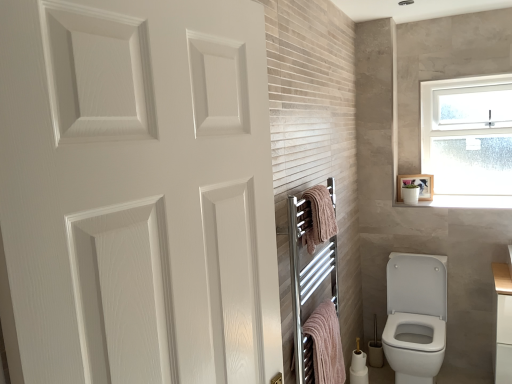
Question: Is white glossy toilet paper at lower right, the 1th toilet paper from the top, placed right next to white glossy toilet at lower right?

Choices:
 (A) yes
 (B) no

Answer: (B)

Question: From a real-world perspective, is white glossy toilet paper at lower right, the 1th toilet paper from the top, over white glossy toilet at lower right?

Choices:
 (A) no
 (B) yes

Answer: (A)

Question: Can you confirm if white glossy toilet paper at lower right, positioned as the second toilet paper in bottom-to-top order, is smaller than white glossy toilet at lower right?

Choices:
 (A) no
 (B) yes

Answer: (B)

Question: Can white glossy toilet at lower right be found inside white glossy toilet paper at lower right, the 1th toilet paper from the top?

Choices:
 (A) yes
 (B) no

Answer: (B)

Question: Does white glossy toilet paper at lower right, the 1th toilet paper from the top, have a lesser height compared to white glossy toilet at lower right?

Choices:
 (A) no
 (B) yes

Answer: (B)

Question: Is white glossy toilet paper at lower right, the 1th toilet paper from the top, at the right side of white glossy toilet at lower right?

Choices:
 (A) no
 (B) yes

Answer: (A)

Question: Considering the relative positions of white glossy toilet at lower right and white glossy toilet paper at lower right, positioned as the second toilet paper in bottom-to-top order, in the image provided, is white glossy toilet at lower right behind white glossy toilet paper at lower right, positioned as the second toilet paper in bottom-to-top order,?

Choices:
 (A) yes
 (B) no

Answer: (B)

Question: Can white glossy toilet paper at lower right, the 1th toilet paper from the top, be found inside white glossy toilet at lower right?

Choices:
 (A) no
 (B) yes

Answer: (A)

Question: From a real-world perspective, is white glossy toilet at lower right on top of white glossy toilet paper at lower right, the 1th toilet paper from the top?

Choices:
 (A) yes
 (B) no

Answer: (A)

Question: Considering the relative sizes of white glossy toilet at lower right and white glossy toilet paper at lower right, positioned as the second toilet paper in bottom-to-top order, in the image provided, is white glossy toilet at lower right smaller than white glossy toilet paper at lower right, positioned as the second toilet paper in bottom-to-top order,?

Choices:
 (A) yes
 (B) no

Answer: (B)

Question: Is white glossy toilet at lower right not near white glossy toilet paper at lower right, positioned as the second toilet paper in bottom-to-top order?

Choices:
 (A) yes
 (B) no

Answer: (B)

Question: Does white glossy toilet at lower right have a greater height compared to white glossy toilet paper at lower right, the 1th toilet paper from the top?

Choices:
 (A) yes
 (B) no

Answer: (A)

Question: Is white glossy medicine cabinet at upper right thinner than white glossy toilet at lower right?

Choices:
 (A) yes
 (B) no

Answer: (A)